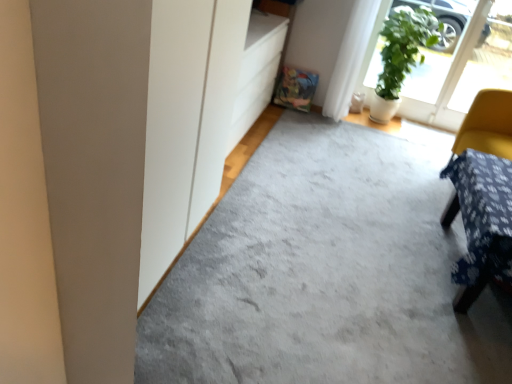
Question: Does green leafy plant at upper right have a larger size compared to green matte screen door at upper right?

Choices:
 (A) yes
 (B) no

Answer: (A)

Question: Considering the relative sizes of green leafy plant at upper right and green matte screen door at upper right in the image provided, is green leafy plant at upper right shorter than green matte screen door at upper right?

Choices:
 (A) yes
 (B) no

Answer: (A)

Question: Is green leafy plant at upper right smaller than green matte screen door at upper right?

Choices:
 (A) no
 (B) yes

Answer: (A)

Question: Is green leafy plant at upper right not near green matte screen door at upper right?

Choices:
 (A) yes
 (B) no

Answer: (B)

Question: From a real-world perspective, is green leafy plant at upper right physically above green matte screen door at upper right?

Choices:
 (A) no
 (B) yes

Answer: (A)

Question: In the image, is transparent glass window at upper right positioned in front of or behind yellow fabric-covered chair at right?

Choices:
 (A) behind
 (B) front

Answer: (A)

Question: From a real-world perspective, is transparent glass window at upper right physically located above or below yellow fabric-covered chair at right?

Choices:
 (A) below
 (B) above

Answer: (B)

Question: Is point (470, 69) positioned closer to the camera than point (508, 110)?

Choices:
 (A) closer
 (B) farther

Answer: (B)

Question: In terms of size, does transparent glass window at upper right appear bigger or smaller than yellow fabric-covered chair at right?

Choices:
 (A) big
 (B) small

Answer: (B)

Question: From a real-world perspective, is green leafy plant at upper right positioned above or below green matte screen door at upper right?

Choices:
 (A) above
 (B) below

Answer: (B)

Question: Based on their sizes in the image, would you say green leafy plant at upper right is bigger or smaller than green matte screen door at upper right?

Choices:
 (A) big
 (B) small

Answer: (A)

Question: From the image's perspective, is green leafy plant at upper right located above or below green matte screen door at upper right?

Choices:
 (A) above
 (B) below

Answer: (B)

Question: From their relative heights in the image, would you say green leafy plant at upper right is taller or shorter than green matte screen door at upper right?

Choices:
 (A) tall
 (B) short

Answer: (B)

Question: Is transparent glass window at upper right wider or thinner than green leafy plant at upper right?

Choices:
 (A) thin
 (B) wide

Answer: (A)

Question: From the image's perspective, is transparent glass window at upper right located above or below green leafy plant at upper right?

Choices:
 (A) above
 (B) below

Answer: (B)